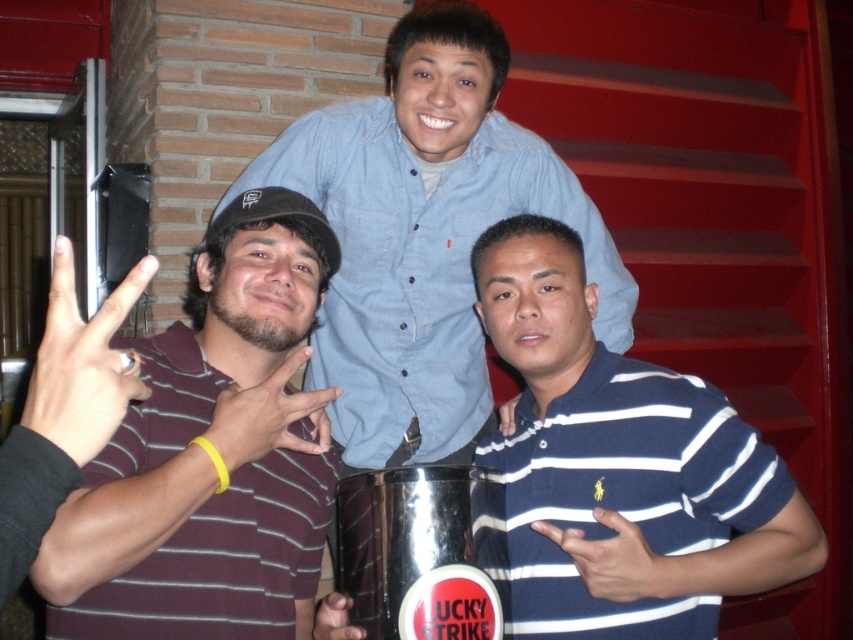
Question: Does maroon striped shirt at center appear under blue striped polo shirt at center?

Choices:
 (A) no
 (B) yes

Answer: (A)

Question: Is blue striped polo shirt at center bigger than shiny metallic can at center?

Choices:
 (A) yes
 (B) no

Answer: (A)

Question: Among these objects, which one is farthest from the camera?

Choices:
 (A) blue denim shirt at upper center
 (B) maroon striped shirt at center
 (C) blue striped polo shirt at center

Answer: (A)

Question: Which object is the farthest from the shiny metallic can at center?

Choices:
 (A) maroon striped shirt at center
 (B) blue denim shirt at upper center
 (C) blue striped polo shirt at center

Answer: (B)

Question: Estimate the real-world distances between objects in this image. Which object is farther from the shiny metallic can at center?

Choices:
 (A) blue striped polo shirt at center
 (B) maroon striped shirt at center

Answer: (B)

Question: Is blue striped polo shirt at center above shiny metallic can at center?

Choices:
 (A) no
 (B) yes

Answer: (B)